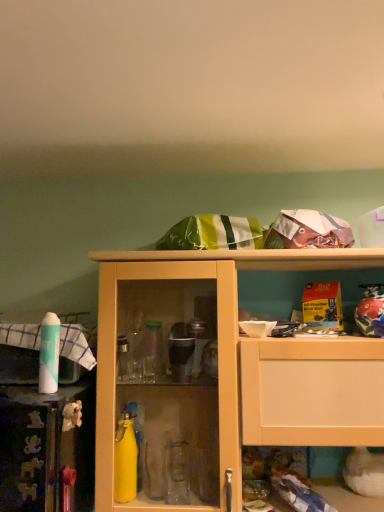
Question: Should I look upward or downward to see matte yellow cabinet at center?

Choices:
 (A) up
 (B) down

Answer: (B)

Question: Considering the relative positions of white matte spray can at left and matte yellow cabinet at center in the image provided, is white matte spray can at left behind matte yellow cabinet at center?

Choices:
 (A) no
 (B) yes

Answer: (B)

Question: Are white matte spray can at left and matte yellow cabinet at center beside each other?

Choices:
 (A) yes
 (B) no

Answer: (B)

Question: Could you tell me if white matte spray can at left is facing matte yellow cabinet at center?

Choices:
 (A) no
 (B) yes

Answer: (A)

Question: Does white matte spray can at left have a greater height compared to matte yellow cabinet at center?

Choices:
 (A) no
 (B) yes

Answer: (A)

Question: Can you confirm if white matte spray can at left is smaller than matte yellow cabinet at center?

Choices:
 (A) no
 (B) yes

Answer: (B)

Question: Considering the relative sizes of white matte spray can at left and matte yellow cabinet at center in the image provided, is white matte spray can at left thinner than matte yellow cabinet at center?

Choices:
 (A) yes
 (B) no

Answer: (A)

Question: Can you confirm if matte yellow cabinet at center is wider than white matte spray can at left?

Choices:
 (A) no
 (B) yes

Answer: (B)

Question: From a real-world perspective, does matte yellow cabinet at center sit lower than white matte spray can at left?

Choices:
 (A) no
 (B) yes

Answer: (B)

Question: From the image's perspective, is matte yellow cabinet at center located above white matte spray can at left?

Choices:
 (A) no
 (B) yes

Answer: (A)

Question: Does matte yellow cabinet at center have a lesser height compared to white matte spray can at left?

Choices:
 (A) no
 (B) yes

Answer: (A)

Question: Is matte yellow cabinet at center to the left of white matte spray can at left from the viewer's perspective?

Choices:
 (A) yes
 (B) no

Answer: (B)

Question: Does matte yellow cabinet at center have a greater height compared to white matte spray can at left?

Choices:
 (A) yes
 (B) no

Answer: (A)

Question: Is matte yellow cabinet at center in front of or behind white matte spray can at left in the image?

Choices:
 (A) behind
 (B) front

Answer: (B)